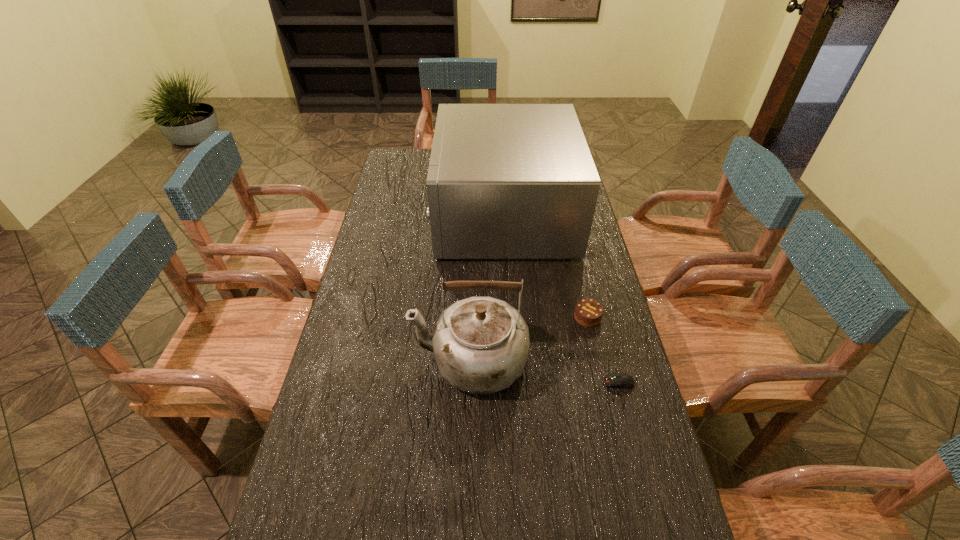
Locate an element on the screen. The width and height of the screenshot is (960, 540). vacant space that satisfies the following two spatial constraints: 1. at the spout of the kettle; 2. on the left side of the chocolate cake is located at coordinates (470, 317).